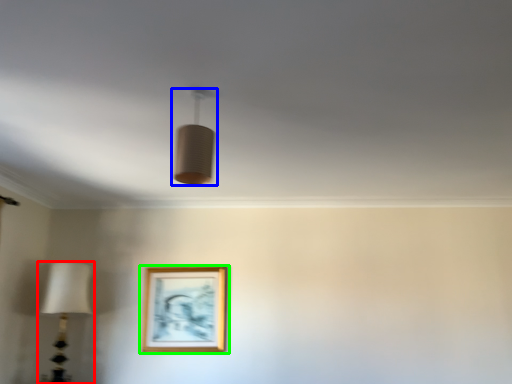
Question: Estimate the real-world distances between objects in this image. Which object is closer to lamp (highlighted by a red box), lamp (highlighted by a blue box) or picture frame (highlighted by a green box)?

Choices:
 (A) lamp
 (B) picture frame

Answer: (B)